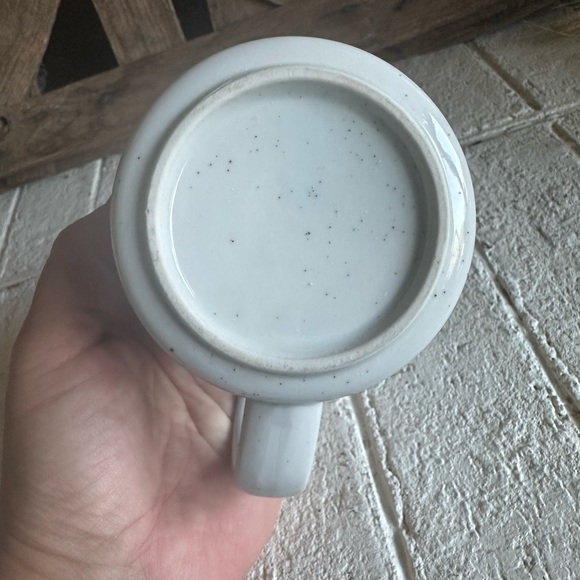
This screenshot has width=580, height=580. I want to click on bottom of a mug, so click(263, 132).